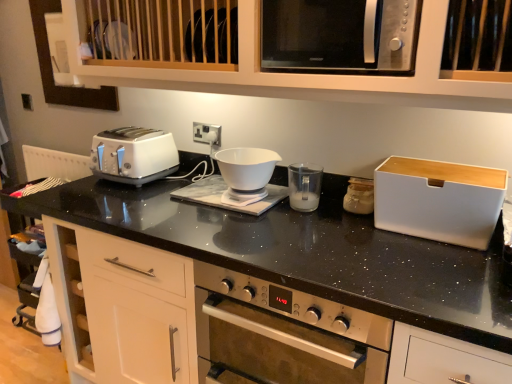
Question: Is white glossy coffee machine at center bigger or smaller than white plastic bread bin at right, marked as the first appliance in a right-to-left arrangement?

Choices:
 (A) small
 (B) big

Answer: (A)

Question: Relative to white plastic bread bin at right, marked as the first appliance in a right-to-left arrangement, is white glossy coffee machine at center in front or behind?

Choices:
 (A) behind
 (B) front

Answer: (A)

Question: Which is farther from the satin silver microwave at upper center?

Choices:
 (A) metallic oven at center
 (B) white glossy bowl at center
 (C) matte glass jar at center-right, acting as the second appliance starting from the right
 (D) black plastic electric outlet at center
 (E) white glossy coffee machine at center

Answer: (A)

Question: Estimate the real-world distances between objects in this image. Which object is closer to the white plastic toaster at left?

Choices:
 (A) black plastic electric outlet at center
 (B) white glossy bowl at center
 (C) matte glass jar at center-right, the second appliance when ordered from left to right
 (D) white plastic bread bin at right, marked as the first appliance in a right-to-left arrangement
 (E) white plastic cup at center, arranged as the first appliance when viewed from the left

Answer: (A)